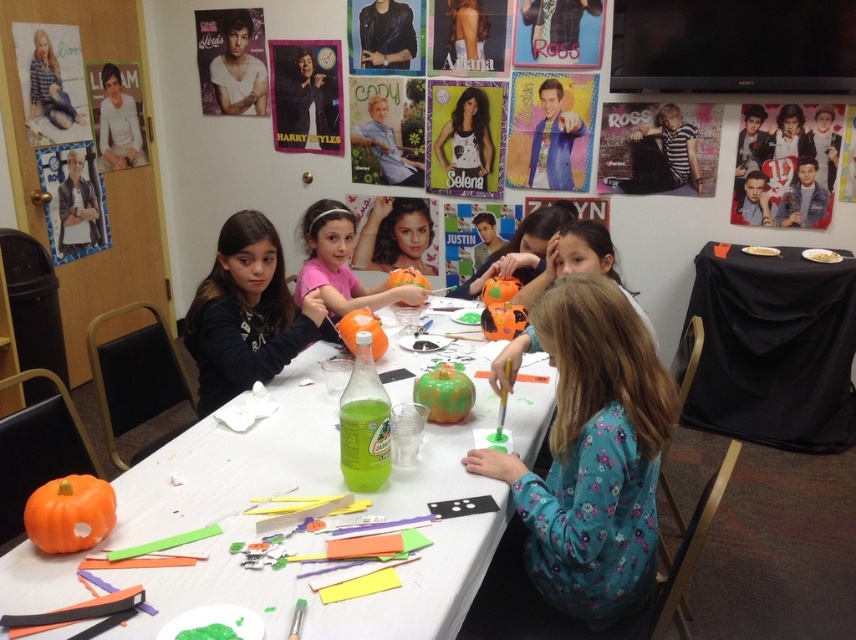
You are a photographer standing in the room and want to take a photo of the matte black shirt at center and the matte orange pumpkin at center. Which object should you focus on first if you want to capture both in the same frame without moving the camera?

The matte black shirt at center is much taller than the matte orange pumpkin at center, so you should focus on the matte black shirt at center first to ensure it fits within the frame.

You are a child participating in the craft activity and want to reach the matte orange pumpkin at lower left to decorate it. However, you are currently standing behind the matte black shirt at center. Can you directly access the pumpkin without moving the shirt?

The matte orange pumpkin at lower left is in front of the matte black shirt at center, so you can directly access the pumpkin without needing to move the shirt.

You are a child participating in the craft activity and want to place your matte orange pumpkin at lower left onto the table where your matte black shirt at center is. Can you do this without moving the shirt?

The matte orange pumpkin at lower left is located below the matte black shirt at center, so it is already positioned under the shirt. Therefore, you can place the pumpkin on the same table without moving the shirt as they are already at the same location.